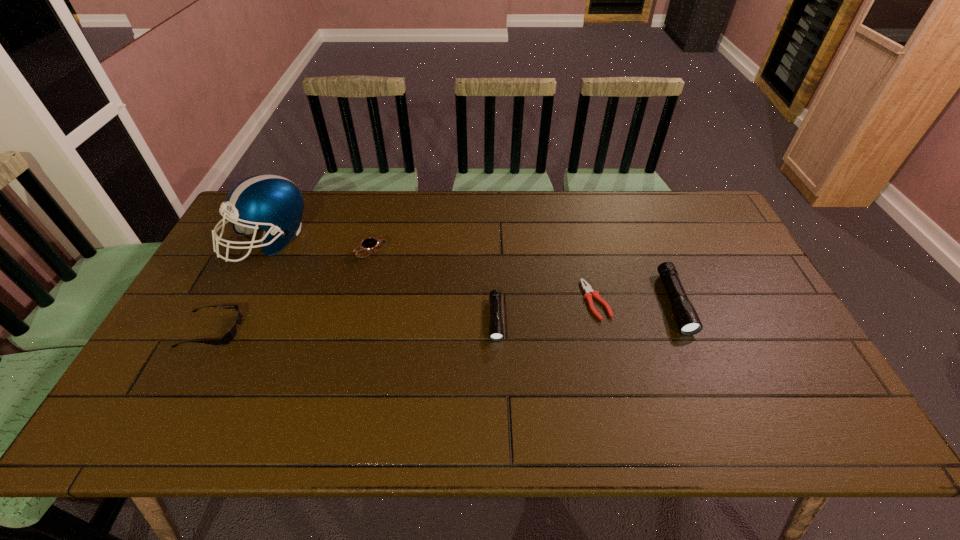
What are the coordinates of `vacant space at the near edge of the desktop` in the screenshot? It's located at (412, 398).

Where is `vacant space at the left edge of the desktop`? The height and width of the screenshot is (540, 960). vacant space at the left edge of the desktop is located at coordinates (237, 256).

Where is `blank space at the right edge`? blank space at the right edge is located at coordinates (726, 318).

Where is `blank space at the far left corner of the desktop`? blank space at the far left corner of the desktop is located at coordinates (233, 232).

In the image, there is a desktop. Where is `vacant space at the near left corner`? The image size is (960, 540). vacant space at the near left corner is located at coordinates (159, 398).

Find the location of `free area in between the sunglasses and the third object from left to right`. free area in between the sunglasses and the third object from left to right is located at coordinates (292, 291).

At what (x,y) coordinates should I click in order to perform the action: click on free spot between the second object from right to left and the sunglasses. Please return your answer as a coordinate pair (x, y). This screenshot has height=540, width=960. Looking at the image, I should click on (403, 315).

Find the location of a particular element. free space between the right flashlight and the left flashlight is located at coordinates (585, 311).

Identify the location of free space between the watch and the second object from right to left. This screenshot has height=540, width=960. (484, 276).

You are a GUI agent. You are given a task and a screenshot of the screen. Output one action in this format:
    pyautogui.click(x=<x>, y=<y>)
    Task: Click on the free space between the fifth shortest object and the pliers
    This screenshot has height=540, width=960.
    Given the screenshot: What is the action you would take?
    pyautogui.click(x=636, y=301)